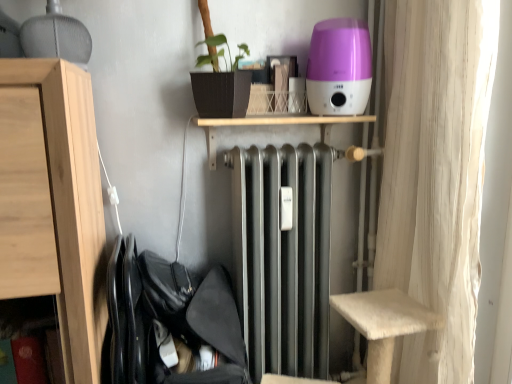
Question: Does black fabric laundry at lower left have a lesser height compared to light wood cabinet at left?

Choices:
 (A) yes
 (B) no

Answer: (A)

Question: Does black fabric laundry at lower left have a lesser width compared to light wood cabinet at left?

Choices:
 (A) yes
 (B) no

Answer: (A)

Question: Considering the relative sizes of black fabric laundry at lower left and light wood cabinet at left in the image provided, is black fabric laundry at lower left bigger than light wood cabinet at left?

Choices:
 (A) yes
 (B) no

Answer: (B)

Question: From the image's perspective, is black fabric laundry at lower left located beneath light wood cabinet at left?

Choices:
 (A) yes
 (B) no

Answer: (A)

Question: Considering the relative sizes of black fabric laundry at lower left and light wood cabinet at left in the image provided, is black fabric laundry at lower left taller than light wood cabinet at left?

Choices:
 (A) no
 (B) yes

Answer: (A)

Question: Could you tell me if black fabric laundry at lower left is turned towards light wood cabinet at left?

Choices:
 (A) no
 (B) yes

Answer: (A)

Question: From a real-world perspective, does purple glossy humidifier at upper center sit lower than metallic silver radiator at center?

Choices:
 (A) no
 (B) yes

Answer: (A)

Question: Is purple glossy humidifier at upper center outside of metallic silver radiator at center?

Choices:
 (A) yes
 (B) no

Answer: (A)

Question: Is the surface of purple glossy humidifier at upper center in direct contact with metallic silver radiator at center?

Choices:
 (A) no
 (B) yes

Answer: (A)

Question: Does purple glossy humidifier at upper center have a smaller size compared to metallic silver radiator at center?

Choices:
 (A) yes
 (B) no

Answer: (A)

Question: Can you confirm if purple glossy humidifier at upper center is thinner than metallic silver radiator at center?

Choices:
 (A) no
 (B) yes

Answer: (B)

Question: Considering the relative sizes of purple glossy humidifier at upper center and metallic silver radiator at center in the image provided, is purple glossy humidifier at upper center shorter than metallic silver radiator at center?

Choices:
 (A) no
 (B) yes

Answer: (A)

Question: Can you confirm if black fabric laundry at lower left is positioned to the left of metallic silver radiator at center?

Choices:
 (A) yes
 (B) no

Answer: (A)